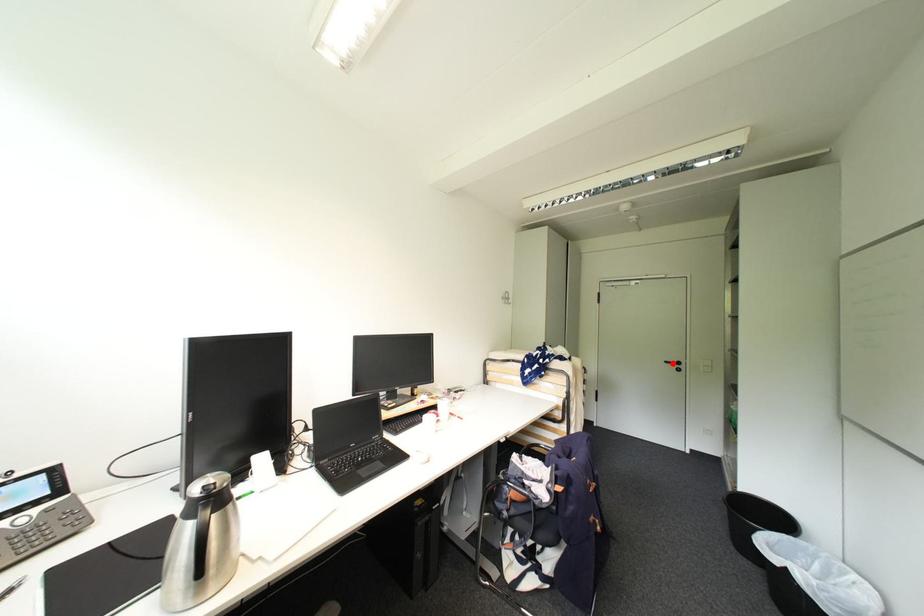
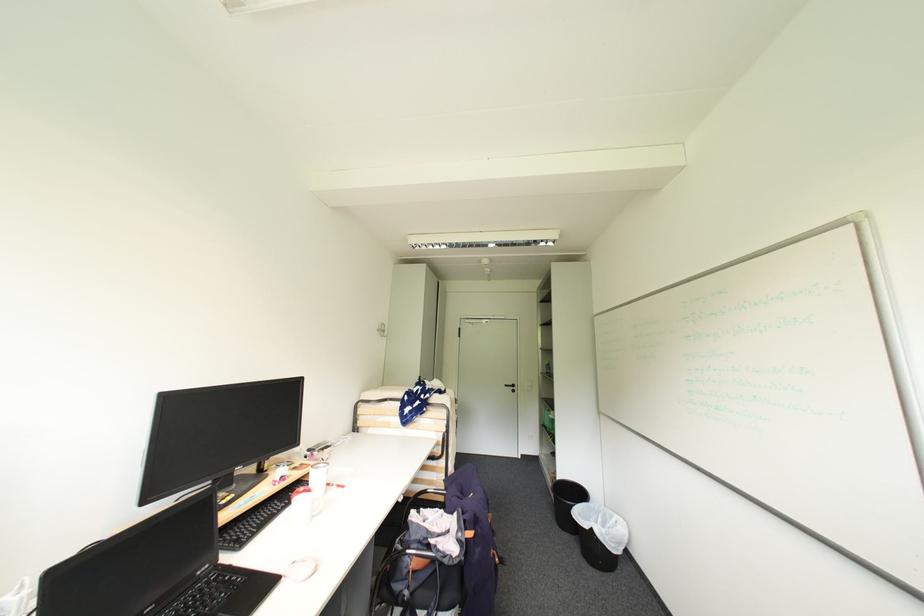
Find the pixel in the second image that matches the highlighted location in the first image.

(513, 387)